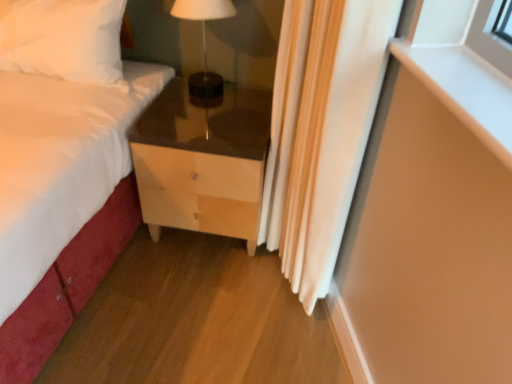
This screenshot has height=384, width=512. Find the location of `blank space situated above matte wood chest of drawers at lower center (from a real-world perspective)`. blank space situated above matte wood chest of drawers at lower center (from a real-world perspective) is located at coordinates (213, 109).